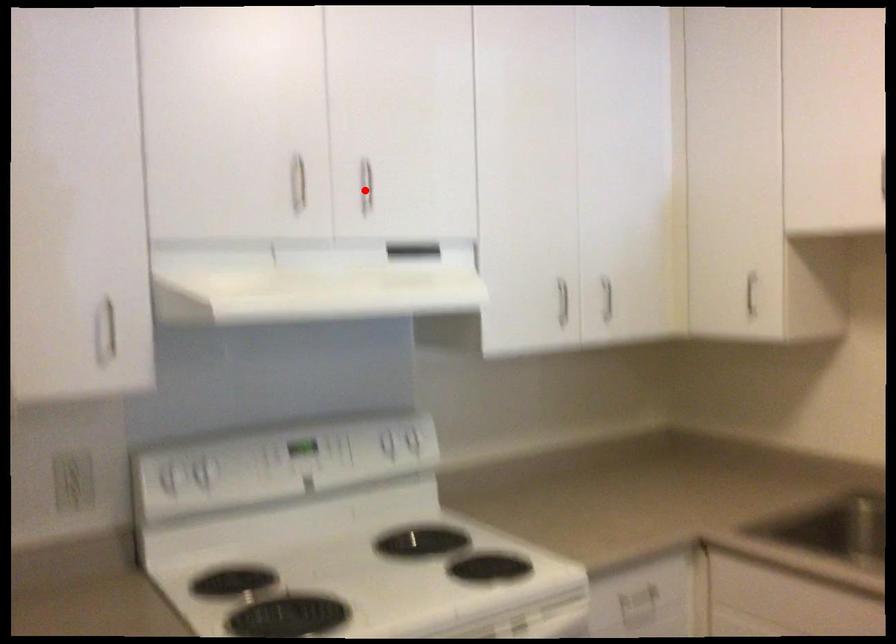
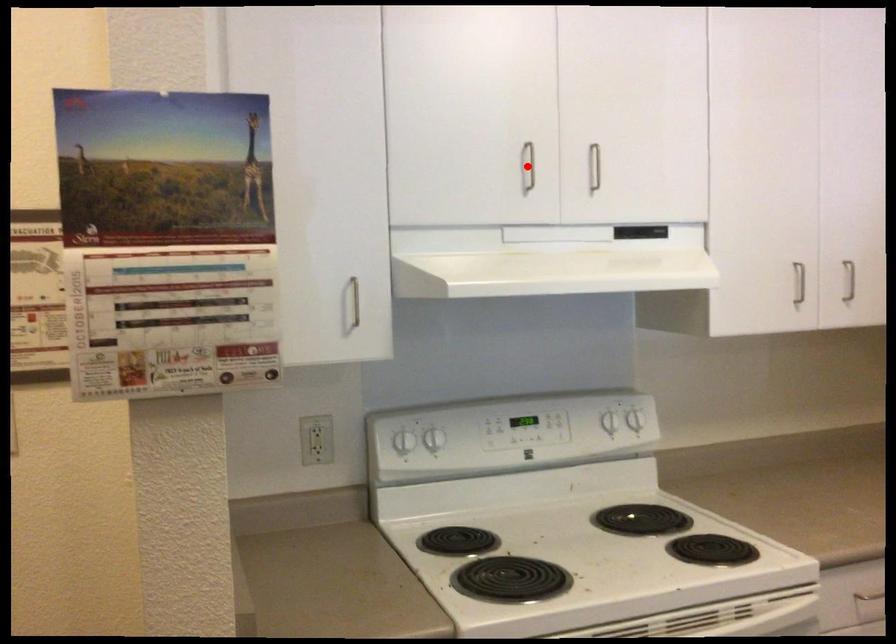
I am providing you with two images of the same scene from different viewpoints. A red point is marked on the first image and another point is marked on the second image. Is the marked point in image1 the same physical position as the marked point in image2?

No